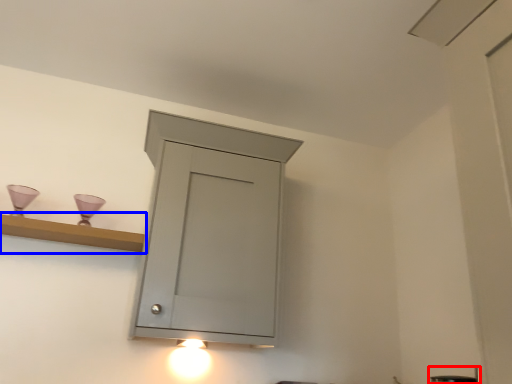
Question: Which point is further to the camera, faucet (highlighted by a red box) or shelf (highlighted by a blue box)?

Choices:
 (A) faucet
 (B) shelf

Answer: (B)